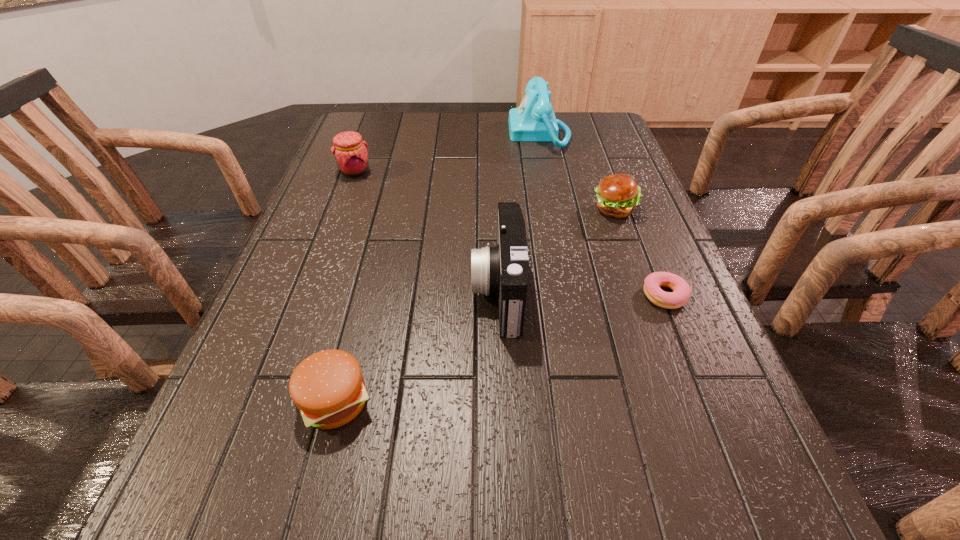
Locate an element on the screen. telephone is located at coordinates (534, 120).

Image resolution: width=960 pixels, height=540 pixels. I want to click on the fourth object from left to right, so click(534, 120).

The height and width of the screenshot is (540, 960). I want to click on the third object from left to right, so click(x=503, y=270).

Find the location of a particular element. Image resolution: width=960 pixels, height=540 pixels. the second farthest object is located at coordinates (350, 151).

Find the location of a particular element. The height and width of the screenshot is (540, 960). the right hamburger is located at coordinates (617, 195).

I want to click on the fourth nearest object, so click(x=617, y=195).

The image size is (960, 540). In order to click on the left hamburger in this screenshot , I will do `click(328, 388)`.

You are a GUI agent. You are given a task and a screenshot of the screen. Output one action in this format:
    pyautogui.click(x=<x>, y=<y>)
    Task: Click on the nearest object
    This screenshot has width=960, height=540.
    Given the screenshot: What is the action you would take?
    pyautogui.click(x=328, y=388)

Where is `the shortest object`? The image size is (960, 540). the shortest object is located at coordinates (681, 292).

You are a GUI agent. You are given a task and a screenshot of the screen. Output one action in this format:
    pyautogui.click(x=<x>, y=<y>)
    Task: Click on the free space located 0.060m on the dial of the farthest object
    This screenshot has width=960, height=540.
    Given the screenshot: What is the action you would take?
    pyautogui.click(x=491, y=133)